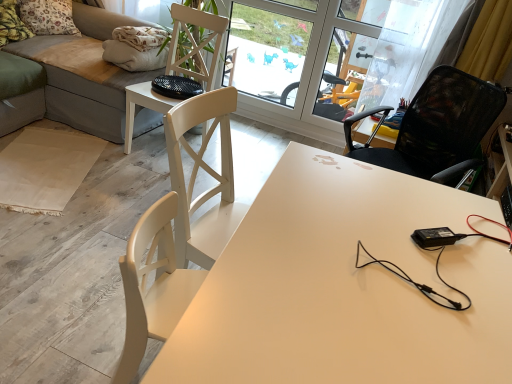
Question: Is velvet grey couch at upper left completely or partially inside white matte desk at center?

Choices:
 (A) yes
 (B) no

Answer: (B)

Question: Is velvet grey couch at upper left at the back of white matte desk at center?

Choices:
 (A) yes
 (B) no

Answer: (B)

Question: From a real-world perspective, does white matte desk at center sit lower than velvet grey couch at upper left?

Choices:
 (A) yes
 (B) no

Answer: (A)

Question: Could you tell me if white matte desk at center is facing velvet grey couch at upper left?

Choices:
 (A) no
 (B) yes

Answer: (A)

Question: Are white matte desk at center and velvet grey couch at upper left beside each other?

Choices:
 (A) no
 (B) yes

Answer: (A)

Question: From the image's perspective, does white matte desk at center appear lower than velvet grey couch at upper left?

Choices:
 (A) yes
 (B) no

Answer: (A)

Question: Would you say white wood chair at center, which appears as the second chair when viewed from the right, contains transparent glass screen door at upper center?

Choices:
 (A) no
 (B) yes

Answer: (A)

Question: Considering the relative sizes of white wood chair at center, which is the first chair in left-to-right order, and transparent glass screen door at upper center in the image provided, is white wood chair at center, which is the first chair in left-to-right order, taller than transparent glass screen door at upper center?

Choices:
 (A) no
 (B) yes

Answer: (A)

Question: Is white wood chair at center, which appears as the second chair when viewed from the right, outside of transparent glass screen door at upper center?

Choices:
 (A) no
 (B) yes

Answer: (B)

Question: Could you tell me if white wood chair at center, which is the first chair in left-to-right order, is turned towards transparent glass screen door at upper center?

Choices:
 (A) yes
 (B) no

Answer: (B)

Question: Is white wood chair at center, which is the first chair in left-to-right order, shorter than transparent glass screen door at upper center?

Choices:
 (A) no
 (B) yes

Answer: (B)

Question: Is white wood chair at center, which appears as the second chair when viewed from the right, further to camera compared to transparent glass screen door at upper center?

Choices:
 (A) yes
 (B) no

Answer: (B)

Question: Considering the relative sizes of white wood chair at center, which is the first chair in left-to-right order, and floral fabric pillow at upper left, positioned as the second pillow in front-to-back order, in the image provided, is white wood chair at center, which is the first chair in left-to-right order, bigger than floral fabric pillow at upper left, positioned as the second pillow in front-to-back order,?

Choices:
 (A) yes
 (B) no

Answer: (A)